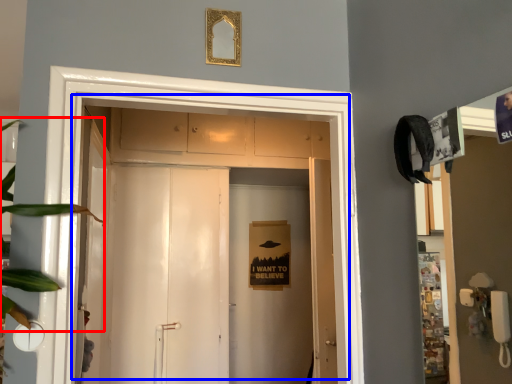
Question: Which point is closer to the camera, plant (highlighted by a red box) or door (highlighted by a blue box)?

Choices:
 (A) plant
 (B) door

Answer: (A)